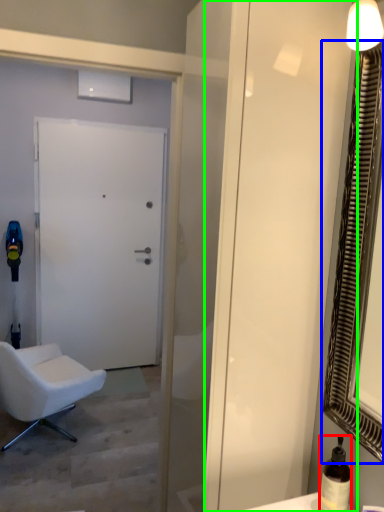
Question: Estimate the real-world distances between objects in this image. Which object is farther from bottle (highlighted by a red box), mirror (highlighted by a blue box) or screen door (highlighted by a green box)?

Choices:
 (A) mirror
 (B) screen door

Answer: (B)